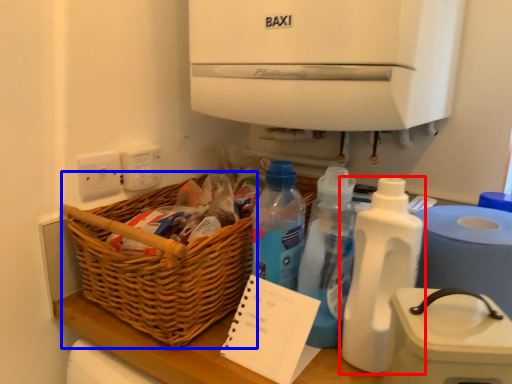
Question: Which point is further to the camera, bottle (highlighted by a red box) or basket (highlighted by a blue box)?

Choices:
 (A) bottle
 (B) basket

Answer: (B)